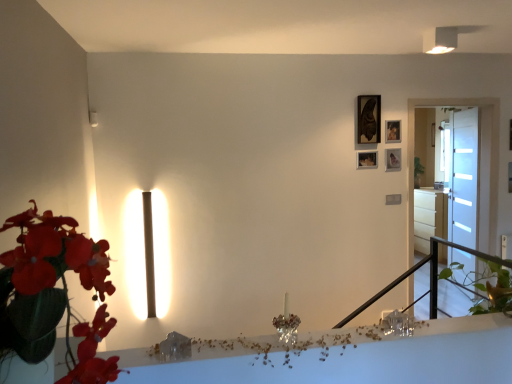
Question: Choose the correct answer: Is matte black picture frame at upper right, which is the 1th picture frame in top-to-bottom order, inside matte black picture frame at upper right, the 1th picture frame ordered from the bottom, or outside it?

Choices:
 (A) outside
 (B) inside

Answer: (A)

Question: Is matte black picture frame at upper right, which is the 1th picture frame in top-to-bottom order, to the left or to the right of matte black picture frame at upper right, the 1th picture frame ordered from the bottom, in the image?

Choices:
 (A) left
 (B) right

Answer: (A)

Question: Which is farther from the matte black picture frame at upper right, the fourth picture frame when ordered from bottom to top?

Choices:
 (A) white frosted glass door at right, acting as the 2th glass door starting from the front
 (B) crystal glass candle at center
 (C) wooden picture frame at upper right, arranged as the second picture frame when ordered from the bottom
 (D) white glossy drawer at right, which appears as the 2th table when viewed from the front
 (E) black metal balustrade at center-right

Answer: (B)

Question: Which object is positioned closest to the matte black picture frame at upper right, which is the 1th picture frame in top-to-bottom order?

Choices:
 (A) wooden picture frame at upper right, the second picture frame positioned from the top
 (B) crystal glass candle at center
 (C) white glossy drawer at right, which appears as the 2th table when viewed from the front
 (D) wooden picture frame at upper right, arranged as the second picture frame when ordered from the bottom
 (E) matte black picture frame at upper right, arranged as the fourth picture frame when viewed from the top

Answer: (A)